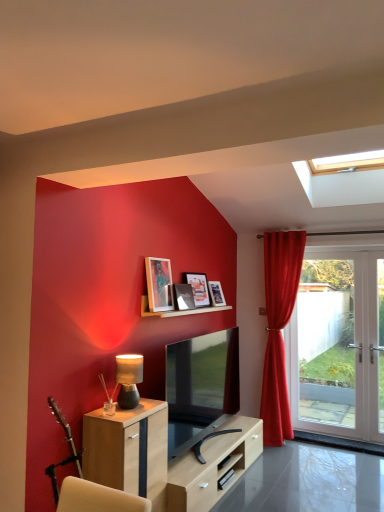
You are a GUI agent. You are given a task and a screenshot of the screen. Output one action in this format:
    pyautogui.click(x=<x>, y=<y>)
    Task: Click on the free region under matte black table lamp at lower left (from a real-world perspective)
    Image resolution: width=384 pixels, height=512 pixels.
    Given the screenshot: What is the action you would take?
    pyautogui.click(x=139, y=404)